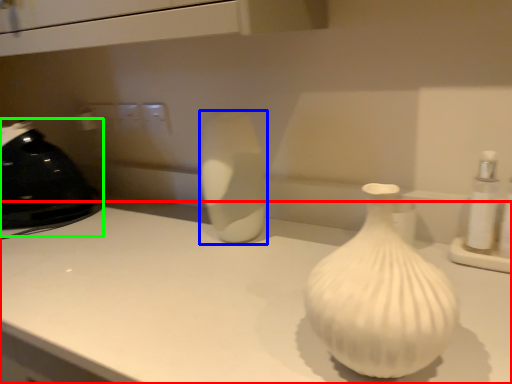
Question: Considering the real-world distances, which object is closest to counter top (highlighted by a red box)? vase (highlighted by a blue box) or appliance (highlighted by a green box).

Choices:
 (A) vase
 (B) appliance

Answer: (A)